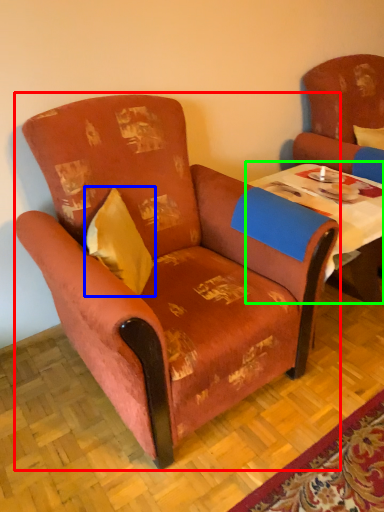
Question: Which is nearer to the chair (highlighted by a red box)? pillow (highlighted by a blue box) or table (highlighted by a green box).

Choices:
 (A) pillow
 (B) table

Answer: (A)